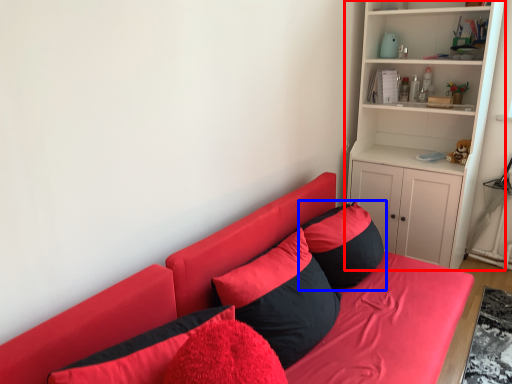
Question: Among these objects, which one is farthest to the camera, shelf (highlighted by a red box) or pillow (highlighted by a blue box)?

Choices:
 (A) shelf
 (B) pillow

Answer: (A)